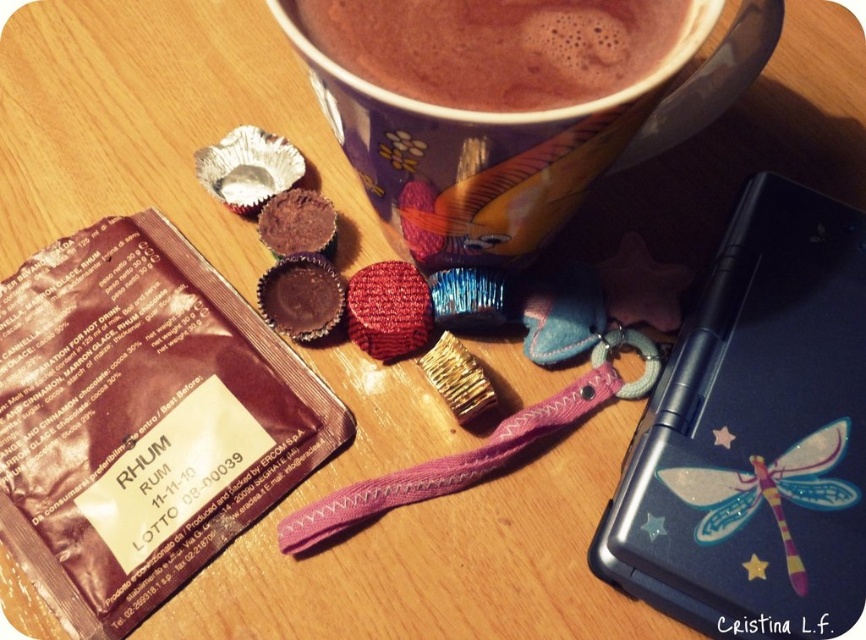
Question: Which object appears farthest from the camera in this image?

Choices:
 (A) brown shiny chocolate bar at lower left
 (B) brown matte cup at upper center
 (C) matte ceramic mug at upper center

Answer: (A)

Question: Which of the following is the farthest from the observer?

Choices:
 (A) (x=447, y=234)
 (B) (x=777, y=513)

Answer: (B)

Question: Does brown shiny chocolate bar at lower left have a greater width compared to matte ceramic mug at upper center?

Choices:
 (A) no
 (B) yes

Answer: (B)

Question: Which point is closer to the camera taking this photo?

Choices:
 (A) (591, 157)
 (B) (443, 33)

Answer: (B)

Question: Can you confirm if brown shiny chocolate bar at lower left is positioned to the left of matte ceramic mug at upper center?

Choices:
 (A) yes
 (B) no

Answer: (A)

Question: Is brown matte cup at upper center smaller than translucent plastic dragonfly at upper right?

Choices:
 (A) yes
 (B) no

Answer: (A)